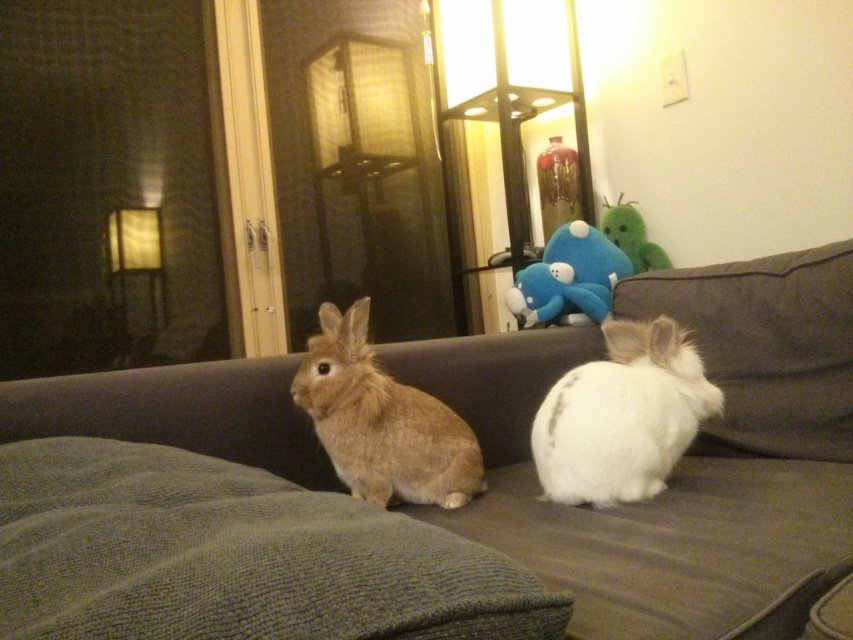
Question: Does blue plush toy at center come behind green plush toy at upper center?

Choices:
 (A) no
 (B) yes

Answer: (A)

Question: Which of the following is the farthest from the observer?

Choices:
 (A) (602, 268)
 (B) (653, 516)

Answer: (A)

Question: Which is farther from the brown fluffy rabbit at center?

Choices:
 (A) brown fabric couch at center
 (B) white fluffy rabbit at center

Answer: (B)

Question: Is white fluffy rabbit at center below blue plush toy at center?

Choices:
 (A) no
 (B) yes

Answer: (B)

Question: Is the position of white fluffy rabbit at center more distant than that of blue plush toy at center?

Choices:
 (A) no
 (B) yes

Answer: (A)

Question: Considering the real-world distances, which object is farthest from the white fluffy rabbit at center?

Choices:
 (A) brown fluffy rabbit at center
 (B) green plush toy at upper center

Answer: (B)